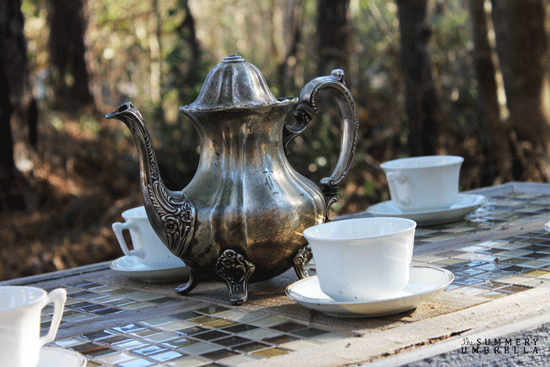
The width and height of the screenshot is (550, 367). Find the location of `cup`. cup is located at coordinates (352, 272).